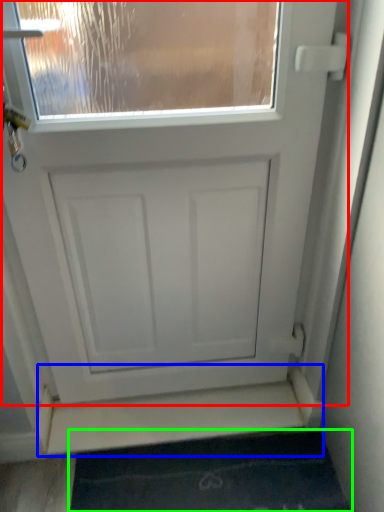
Question: Based on their relative distances, which object is nearer to door (highlighted by a red box)? Choose from stairwell (highlighted by a blue box) and bath mat (highlighted by a green box).

Choices:
 (A) stairwell
 (B) bath mat

Answer: (A)